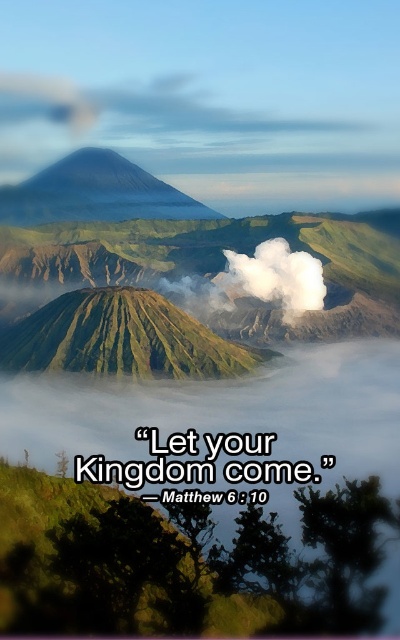
Does point (186, 316) come in front of point (30, 104)?

Yes, point (186, 316) is closer to viewer.

This screenshot has width=400, height=640. What do you see at coordinates (122, 339) in the screenshot? I see `green grassy mountain at center` at bounding box center [122, 339].

Where is `green grassy mountain at center`? green grassy mountain at center is located at coordinates (122, 339).

Does white fluffy cloud at upper left come behind gray volcanic peak at upper left?

Yes, it is behind gray volcanic peak at upper left.

Can you confirm if white fluffy cloud at upper left is positioned to the left of gray volcanic peak at upper left?

In fact, white fluffy cloud at upper left is to the right of gray volcanic peak at upper left.

Between point (170, 108) and point (5, 212), which one is positioned in front?

Point (5, 212)

Locate an element on the screen. Image resolution: width=400 pixels, height=640 pixels. white fluffy cloud at upper left is located at coordinates (140, 106).

Based on the photo, which is above, green grassy mountain at center or gray volcanic peak at upper left?

gray volcanic peak at upper left

Who is more distant from viewer, (192, 360) or (142, 172)?

The point (142, 172) is behind.

The width and height of the screenshot is (400, 640). What do you see at coordinates (122, 339) in the screenshot?
I see `green grassy mountain at center` at bounding box center [122, 339].

At what (x,y) coordinates should I click in order to perform the action: click on green grassy mountain at center. Please return your answer as a coordinate pair (x, y). Looking at the image, I should click on (122, 339).